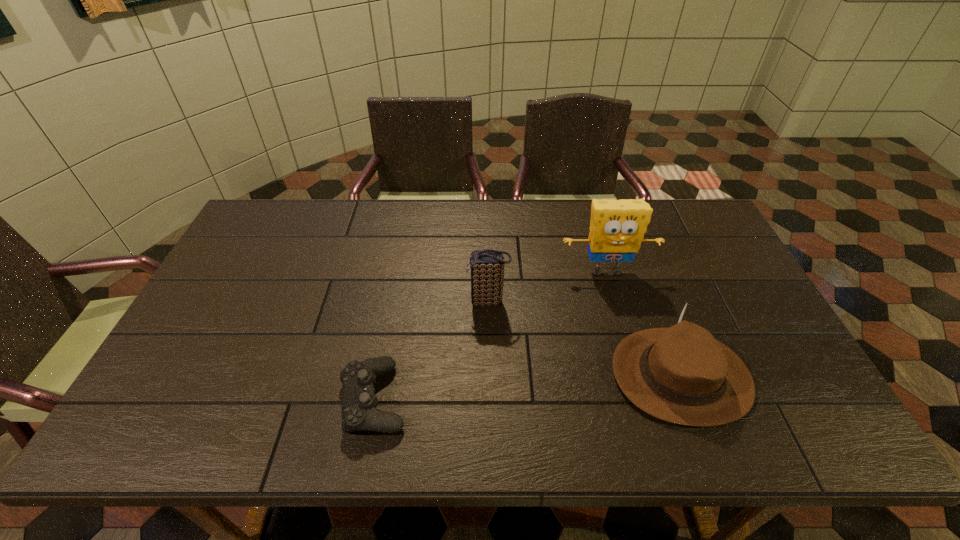
The height and width of the screenshot is (540, 960). What are the coordinates of `vacant area that lies between the third tallest object and the control` in the screenshot? It's located at (527, 387).

This screenshot has width=960, height=540. I want to click on vacant space in between the tallest object and the fedora, so click(x=643, y=323).

Locate an element on the screen. vacant space in between the fedora and the control is located at coordinates (527, 387).

Where is `vacant space in between the second farthest object and the tallest object`? vacant space in between the second farthest object and the tallest object is located at coordinates (547, 287).

Locate which object is the third closest to the control. Please provide its 2D coordinates. Your answer should be formatted as a tuple, i.e. [(x, y)], where the tuple contains the x and y coordinates of a point satisfying the conditions above.

[(681, 374)]

This screenshot has height=540, width=960. What are the coordinates of `the closest object to the control` in the screenshot? It's located at (487, 266).

Locate an element on the screen. The height and width of the screenshot is (540, 960). vacant space that satisfies the following two spatial constraints: 1. on the feather side of the fedora; 2. on the front side of the leftmost object is located at coordinates (688, 398).